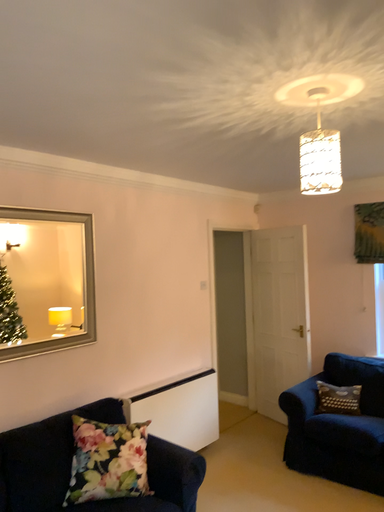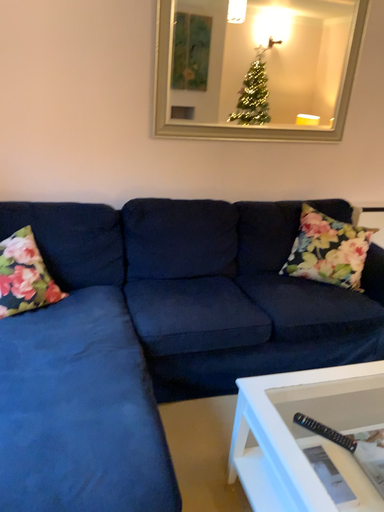
Question: How did the camera likely rotate when shooting the video?

Choices:
 (A) rotated upward
 (B) rotated downward

Answer: (B)